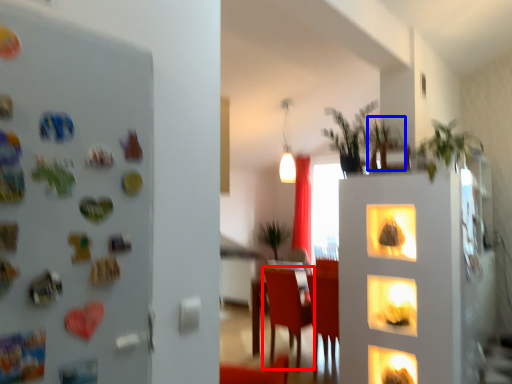
Question: Which object is closer to the camera taking this photo, armchair (highlighted by a red box) or plant (highlighted by a blue box)?

Choices:
 (A) armchair
 (B) plant

Answer: (B)